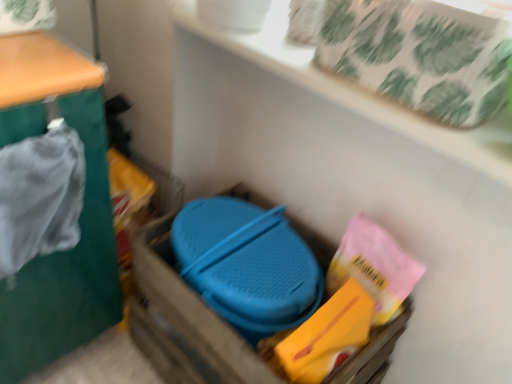
Question: Would you say white textured tray at upper center is to the left or to the right of blue plastic container at center in the picture?

Choices:
 (A) right
 (B) left

Answer: (A)

Question: In terms of height, does white textured tray at upper center look taller or shorter compared to blue plastic container at center?

Choices:
 (A) short
 (B) tall

Answer: (A)

Question: Based on their relative distances, which object is nearer to the blue plastic container at center?

Choices:
 (A) white textured tray at upper center
 (B) green fabric at left

Answer: (B)

Question: Which object is the farthest from the white textured tray at upper center?

Choices:
 (A) green fabric at left
 (B) blue plastic container at center

Answer: (B)